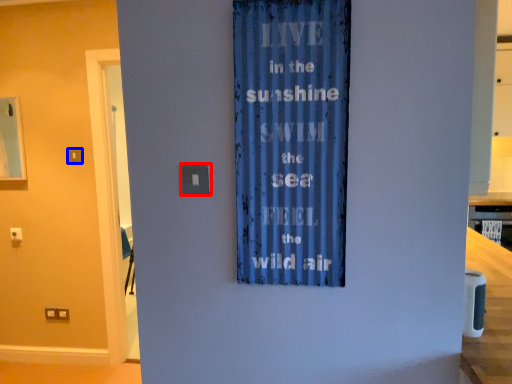
Question: Among these objects, which one is farthest to the camera, light switch (highlighted by a red box) or light switch (highlighted by a blue box)?

Choices:
 (A) light switch
 (B) light switch

Answer: (B)